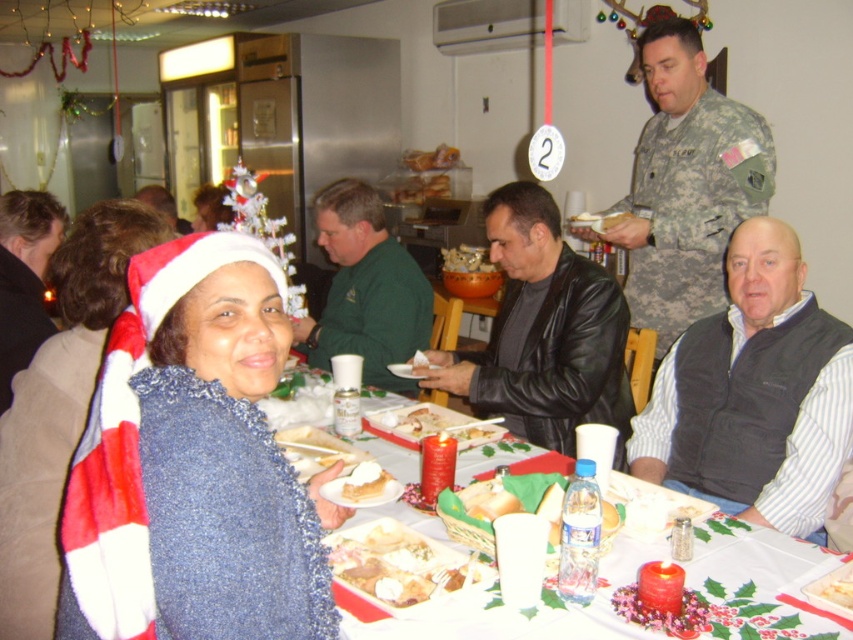
Question: Does blue fuzzy sweater at center have a lesser width compared to black leather jacket at center?

Choices:
 (A) yes
 (B) no

Answer: (A)

Question: Which point is farther to the camera?

Choices:
 (A) camouflage uniform at upper right
 (B) brown hair at left
 (C) black leather jacket at center

Answer: (A)

Question: Is camouflage uniform at upper right below slightly browned bread at center?

Choices:
 (A) yes
 (B) no

Answer: (B)

Question: Can you confirm if white creamy cake at center is positioned below white bread at table?

Choices:
 (A) no
 (B) yes

Answer: (A)

Question: Based on their relative distances, which object is farther from the black leather jacket at center?

Choices:
 (A) golden brown bread at center
 (B) green matte shirt at center
 (C) slightly browned bread at center
 (D) fuzzy red-white scarf at center

Answer: (D)

Question: Which is farther from the blue fuzzy sweater at center?

Choices:
 (A) black leather jacket at center
 (B) slightly browned bread at center
 (C) white creamy cake at center
 (D) camouflage uniform at upper right

Answer: (D)